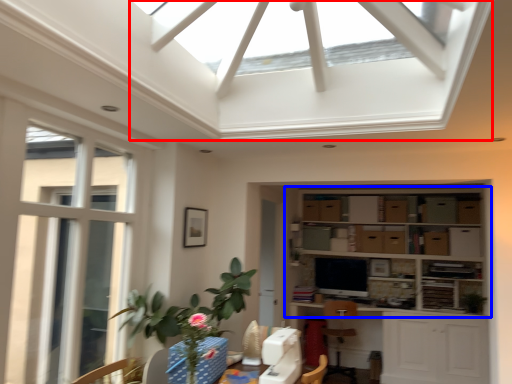
Question: Which point is closer to the camera, exhaust hood (highlighted by a red box) or shelf (highlighted by a blue box)?

Choices:
 (A) exhaust hood
 (B) shelf

Answer: (A)